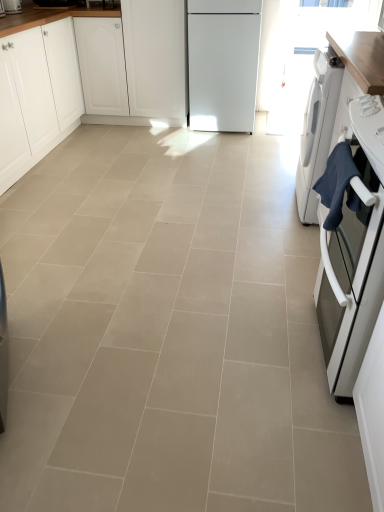
I want to click on free space to the back side of white glossy washing machine at right, which is counted as the first home appliance, starting from the back, so click(x=273, y=177).